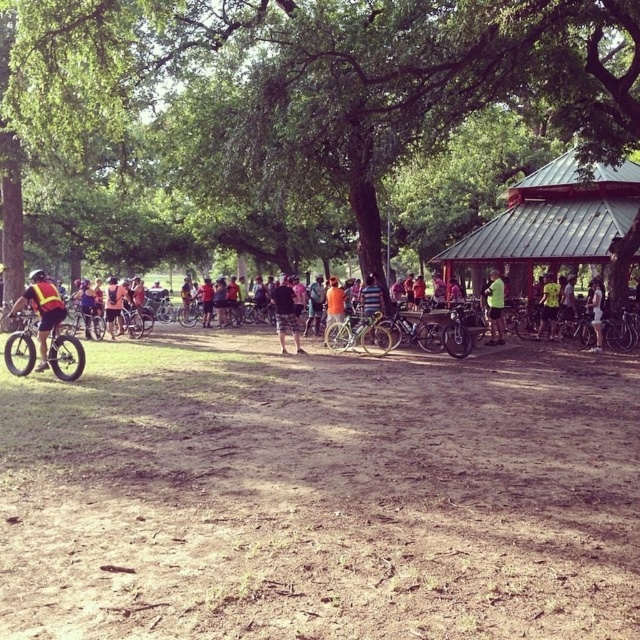
You are a photographer standing at the center of the scene. You want to take a photo of the fat tire bike at left and the black mesh shirt at center. How far apart are these two objects in feet?

The fat tire bike at left is 19.48 feet away from the black mesh shirt at center.

You are a photographer standing in the park and see both the reflective safety vest at center and the green fabric shirt at center. Which object would appear larger in your photo if you focus on the center of the image?

The reflective safety vest at center would appear larger in the photo because it is much taller than the green fabric shirt at center.

You are a photographer at the park and want to capture both the reflective safety vest at center and the green fabric shirt at center in a single shot. Which object should you focus on first if you want to ensure both are clearly visible in the frame?

You should focus on the reflective safety vest at center first because it is larger in size than the green fabric shirt at center, making it easier to frame and ensure visibility.